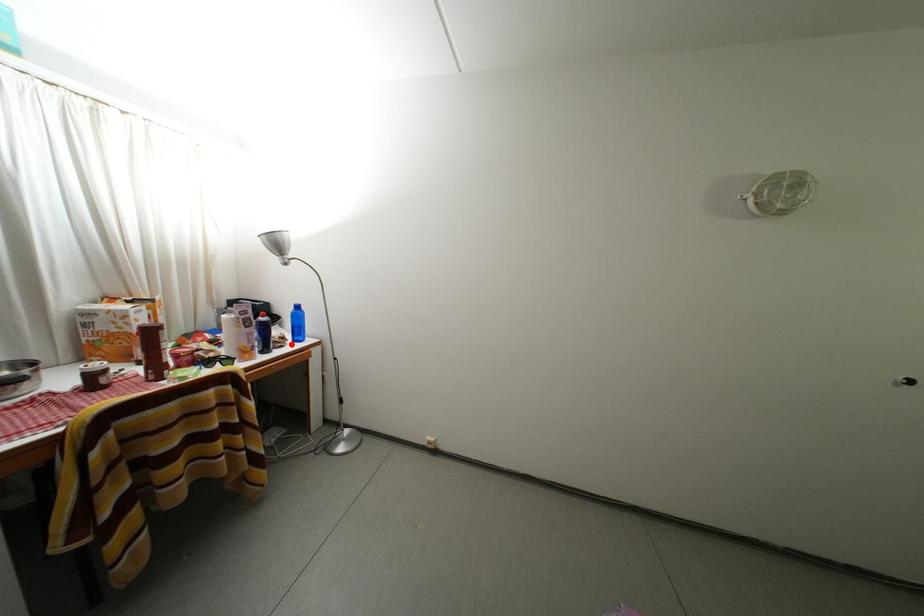
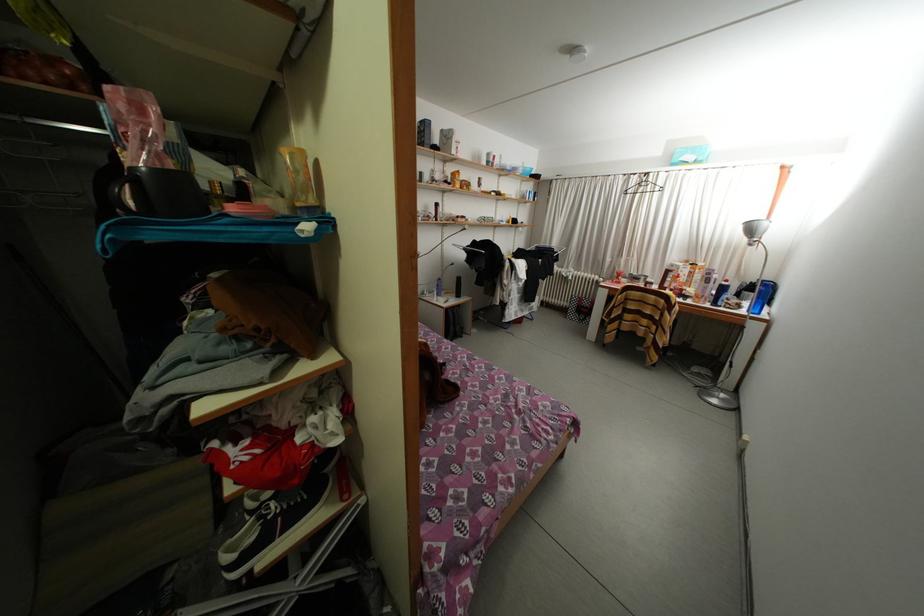
Locate, in the second image, the point that corresponds to the highlighted location in the first image.

(747, 310)